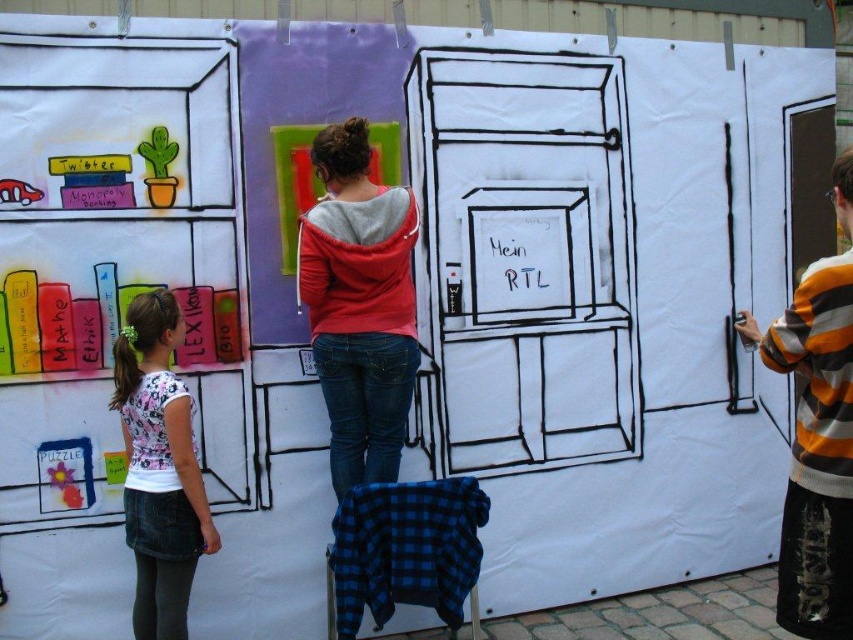
You are a photographer trying to capture a clear shot of both the striped sweater at right and the white printed shirt at left. Since you want both subjects to be visible, which one should you focus on first to ensure the other remains in focus?

You should focus on the striped sweater at right first because it is in front of the white printed shirt at left, so focusing on the closer object will keep the background subject in focus.

You are a photographer trying to capture both the red hoodie at center and the white printed shirt at left in a single frame. However, your camera can only focus on one layer at a time. Which clothing item should you adjust your focus to first to ensure both are visible?

The red hoodie at center is positioned over the white printed shirt at left, so you should focus on the red hoodie at center first to ensure both are visible.

You are standing at point [358,305]. What is the object located here?

The object at point [358,305] is a red hoodie at center.